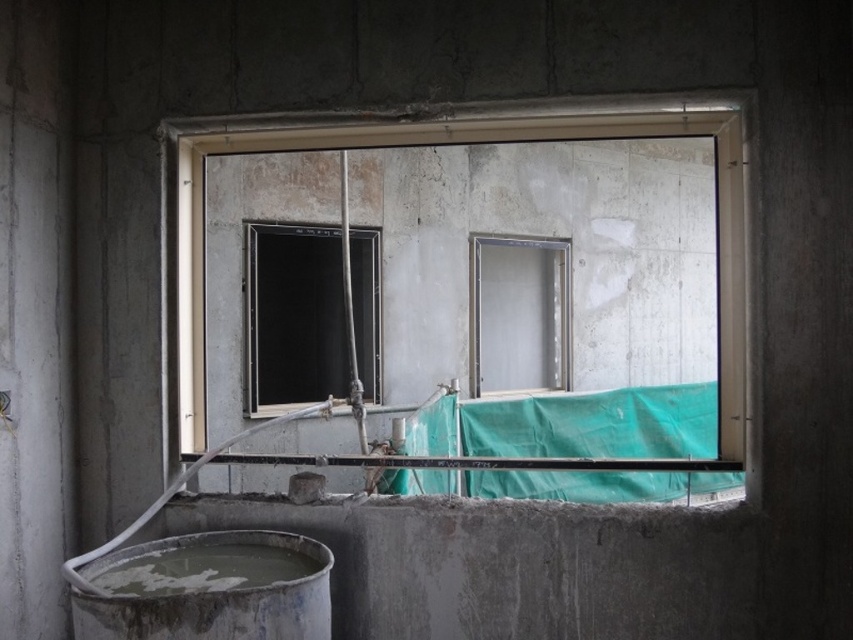
Question: Which object is the closest to the dirty concrete tub at lower left?

Choices:
 (A) smooth concrete window at center
 (B) clear glass door at center

Answer: (A)

Question: Which of the following is the farthest from the observer?

Choices:
 (A) smooth concrete window at center
 (B) clear glass door at center
 (C) dirty concrete tub at lower left

Answer: (B)

Question: Is dirty concrete tub at lower left to the right of transparent glass window at center from the viewer's perspective?

Choices:
 (A) yes
 (B) no

Answer: (A)

Question: Which object is closer to the camera taking this photo?

Choices:
 (A) clear glass door at center
 (B) smooth concrete window at center
 (C) transparent glass window at center

Answer: (B)

Question: Does dirty concrete tub at lower left have a smaller size compared to transparent glass window at center?

Choices:
 (A) yes
 (B) no

Answer: (A)

Question: Is smooth concrete window at center positioned in front of transparent glass window at center?

Choices:
 (A) no
 (B) yes

Answer: (B)